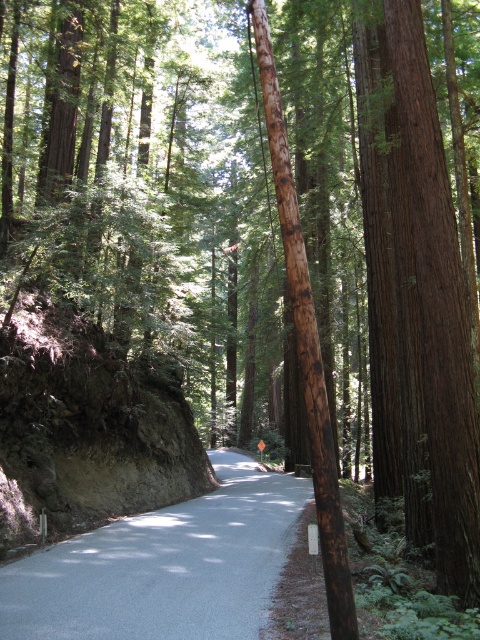
Question: Among these points, which one is farthest from the camera?

Choices:
 (A) (409, 520)
 (B) (98, 536)

Answer: (B)

Question: Where is brown rough textured tree at right located in relation to gray asphalt road at center in the image?

Choices:
 (A) left
 (B) right

Answer: (B)

Question: Does gray asphalt road at center have a greater width compared to brown rough wooden pole at center?

Choices:
 (A) yes
 (B) no

Answer: (A)

Question: Which point is closer to the camera taking this photo?

Choices:
 (A) (420, 536)
 (B) (145, 620)
 (C) (279, 154)

Answer: (C)

Question: Which of the following is the closest to the observer?

Choices:
 (A) (84, 612)
 (B) (284, 216)
 (C) (362, 125)

Answer: (B)

Question: From the image, what is the correct spatial relationship of gray asphalt road at center in relation to brown rough wooden pole at center?

Choices:
 (A) below
 (B) above

Answer: (A)